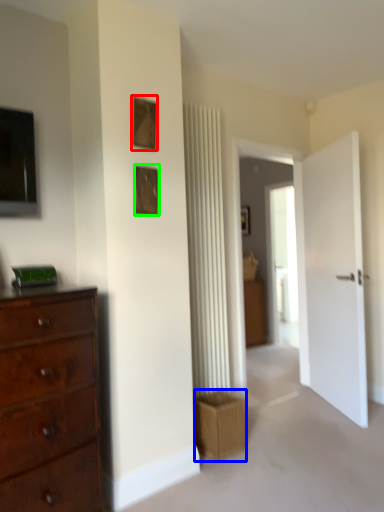
Question: Considering the real-world distances, which object is farthest from picture frame (highlighted by a red box)? crate (highlighted by a blue box) or picture frame (highlighted by a green box)?

Choices:
 (A) crate
 (B) picture frame

Answer: (A)